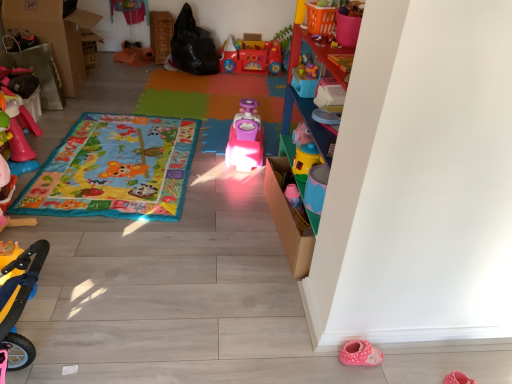
Question: Does rubberized pink toy at left, the 4th toy in the back-to-front sequence, turn towards multicolored fabric play mat at center, which is counted as the second blanket, starting from the back?

Choices:
 (A) no
 (B) yes

Answer: (B)

Question: Considering the relative sizes of rubberized pink toy at left, placed as the 5th toy when sorted from front to back, and multicolored fabric play mat at center, the 1th blanket viewed from the front, in the image provided, is rubberized pink toy at left, placed as the 5th toy when sorted from front to back, smaller than multicolored fabric play mat at center, the 1th blanket viewed from the front,?

Choices:
 (A) no
 (B) yes

Answer: (A)

Question: Does rubberized pink toy at left, the 4th toy in the back-to-front sequence, have a lesser width compared to multicolored fabric play mat at center, which is counted as the second blanket, starting from the back?

Choices:
 (A) yes
 (B) no

Answer: (A)

Question: From a real-world perspective, is rubberized pink toy at left, which is counted as the 8th toy, starting from the right, over multicolored fabric play mat at center, the 1th blanket viewed from the front?

Choices:
 (A) yes
 (B) no

Answer: (A)

Question: Does rubberized pink toy at left, the 4th toy in the back-to-front sequence, come in front of multicolored fabric play mat at center, which is counted as the second blanket, starting from the back?

Choices:
 (A) yes
 (B) no

Answer: (B)

Question: Is rubberized pink toy at left, placed as the 5th toy when sorted from front to back, not near multicolored fabric play mat at center, which is counted as the second blanket, starting from the back?

Choices:
 (A) yes
 (B) no

Answer: (B)

Question: Considering the relative sizes of cardboard box at left and pink plastic toy at center, the 6th toy in the front-to-back sequence, in the image provided, is cardboard box at left taller than pink plastic toy at center, the 6th toy in the front-to-back sequence,?

Choices:
 (A) no
 (B) yes

Answer: (B)

Question: Is cardboard box at left closer to the viewer compared to pink plastic toy at center, which is the fifth toy in left-to-right order?

Choices:
 (A) no
 (B) yes

Answer: (A)

Question: Is cardboard box at left further to the viewer compared to pink plastic toy at center, which is the fifth toy in left-to-right order?

Choices:
 (A) yes
 (B) no

Answer: (A)

Question: Considering the relative sizes of cardboard box at left and pink plastic toy at center, the 6th toy in the front-to-back sequence, in the image provided, is cardboard box at left bigger than pink plastic toy at center, the 6th toy in the front-to-back sequence,?

Choices:
 (A) yes
 (B) no

Answer: (A)

Question: From the image's perspective, is cardboard box at left above pink plastic toy at center, which is the fifth toy in left-to-right order?

Choices:
 (A) no
 (B) yes

Answer: (B)

Question: From a real-world perspective, is cardboard box at left physically below pink plastic toy at center, the 6th toy in the front-to-back sequence?

Choices:
 (A) yes
 (B) no

Answer: (B)

Question: Can we say yellow plastic scooter at lower left, placed as the 5th toy when sorted from right to left, lies outside matte pink car at center, the first blanket when ordered from back to front?

Choices:
 (A) no
 (B) yes

Answer: (B)